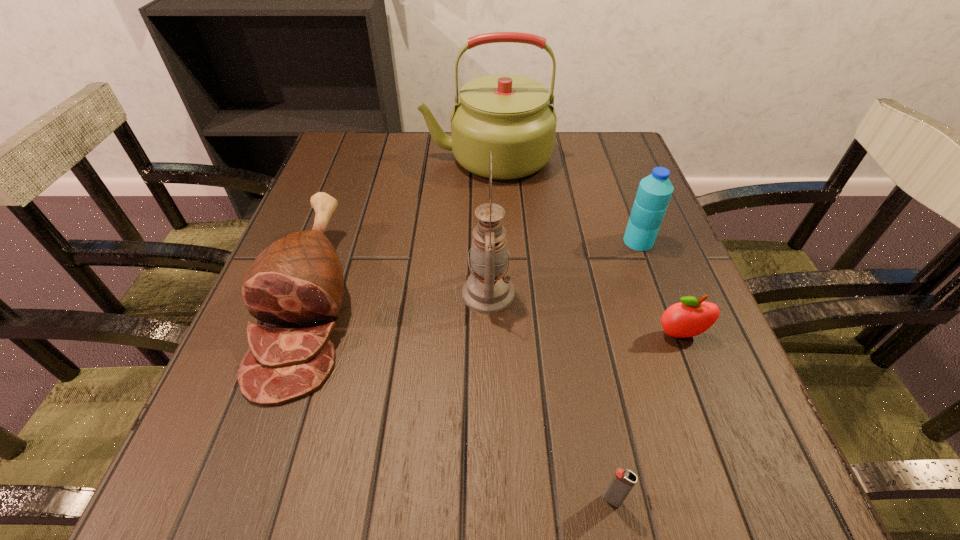
Locate an element on the screen. free location that satisfies the following two spatial constraints: 1. on the back side of the nearest object; 2. at the spout of the kettle is located at coordinates (545, 157).

Where is `vacant area in the image that satisfies the following two spatial constraints: 1. at the spout of the fourth shortest object; 2. on the right side of the farthest object`? The height and width of the screenshot is (540, 960). vacant area in the image that satisfies the following two spatial constraints: 1. at the spout of the fourth shortest object; 2. on the right side of the farthest object is located at coordinates (489, 241).

Image resolution: width=960 pixels, height=540 pixels. What are the coordinates of `vacant region that satisfies the following two spatial constraints: 1. at the spout of the apple; 2. on the left side of the kettle` in the screenshot? It's located at (491, 335).

This screenshot has width=960, height=540. Find the location of `free space that satisfies the following two spatial constraints: 1. on the back side of the fifth tallest object; 2. at the spout of the farthest object`. free space that satisfies the following two spatial constraints: 1. on the back side of the fifth tallest object; 2. at the spout of the farthest object is located at coordinates (612, 157).

Find the location of `free region that satisfies the following two spatial constraints: 1. at the spout of the water bottle; 2. on the right side of the farthest object`. free region that satisfies the following two spatial constraints: 1. at the spout of the water bottle; 2. on the right side of the farthest object is located at coordinates (489, 241).

Where is `free location that satisfies the following two spatial constraints: 1. at the spout of the water bottle; 2. on the right side of the farthest object`? The image size is (960, 540). free location that satisfies the following two spatial constraints: 1. at the spout of the water bottle; 2. on the right side of the farthest object is located at coordinates (489, 241).